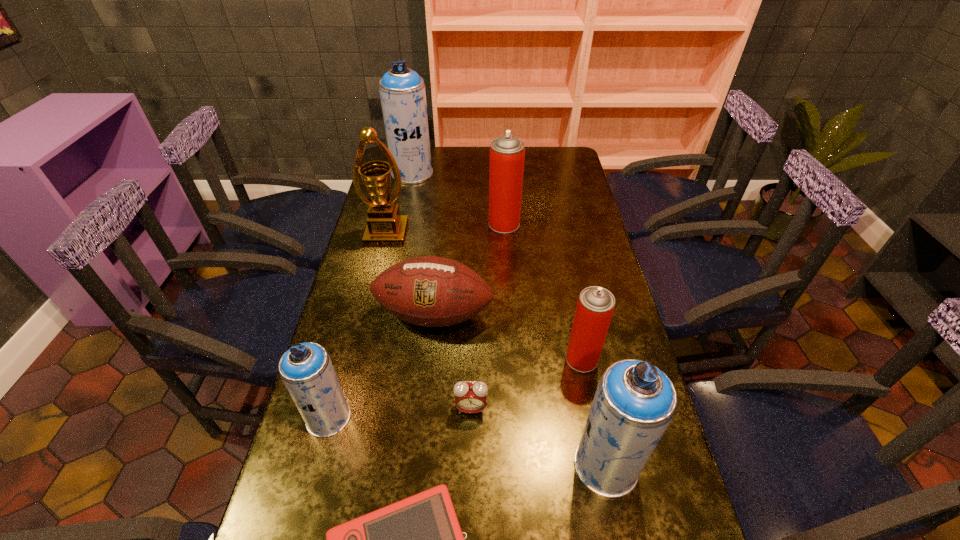
Image resolution: width=960 pixels, height=540 pixels. What are the coordinates of `brown football (American)` in the screenshot? It's located at (430, 291).

The image size is (960, 540). In order to click on pink alarm clock in this screenshot , I will do `click(470, 397)`.

Where is `alarm clock`? The width and height of the screenshot is (960, 540). alarm clock is located at coordinates (470, 397).

The height and width of the screenshot is (540, 960). What are the coordinates of `vacant space located on the right of the tallest aerosol can` in the screenshot? It's located at (478, 173).

This screenshot has width=960, height=540. What are the coordinates of `free point located 0.330m on the front-facing side of the gold award` in the screenshot? It's located at (366, 320).

The image size is (960, 540). Find the location of `vacant region located 0.310m on the front of the farther red aerosol can`. vacant region located 0.310m on the front of the farther red aerosol can is located at coordinates (509, 297).

At what (x,y) coordinates should I click in order to perform the action: click on free region located 0.330m on the back of the second smallest blue aerosol can. Please return your answer as a coordinate pair (x, y). This screenshot has height=540, width=960. Looking at the image, I should click on (577, 326).

Locate an element on the screen. This screenshot has width=960, height=540. vacant space located on the right of the smallest blue aerosol can is located at coordinates (450, 417).

At what (x,y) coordinates should I click in order to perform the action: click on vacant area situated on the left of the smaller red aerosol can. Please return your answer as a coordinate pair (x, y). The image size is (960, 540). Looking at the image, I should click on (543, 359).

Where is `free spot located 0.280m on the front of the football (American)`? This screenshot has width=960, height=540. free spot located 0.280m on the front of the football (American) is located at coordinates (421, 438).